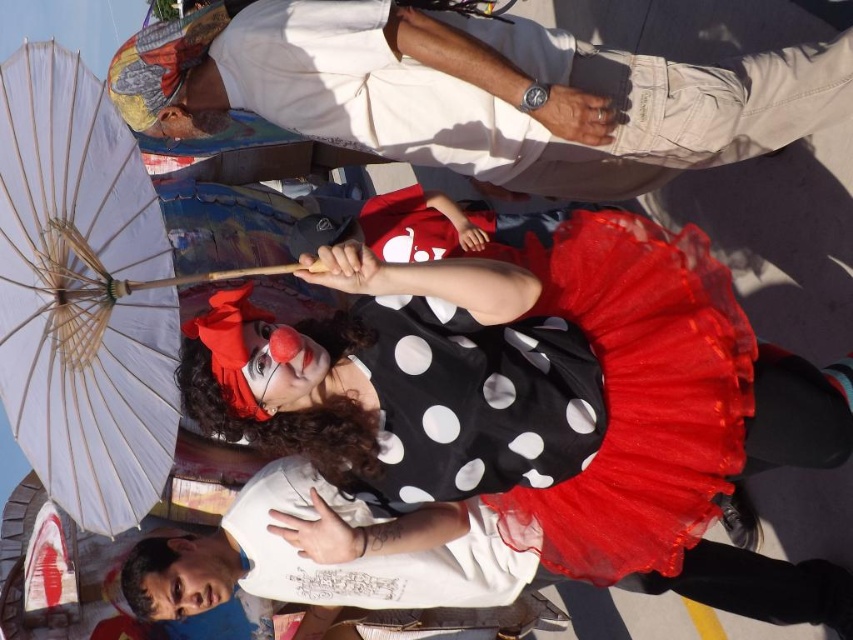
You are a photographer setting up for a group photo. You have a camera with a 30cm wide lens. You need to capture both the white cotton shirt at upper center and the black polka dot tulle dress at center in the same frame. Can the lens accommodate both objects if they are positioned side by side?

The white cotton shirt at upper center might be wider than the black polka dot tulle dress at center. Since the lens is 30cm wide, it depends on their combined width. If the total width of both objects together is less than or equal to 30cm, they can fit. However, if their combined width exceeds 30cm, they might not fit. The exact measurement isn

You are a photographer at the event and want to capture a clear photo of both the white cotton shirt at upper center and the white paper umbrella at left. Which object should you focus on first to ensure both are in focus?

You should focus on the white cotton shirt at upper center first because it is closer to you than the white paper umbrella at left. By focusing on the closer object, the umbrella will also be in focus due to the depth of field.

You are a photographer standing at the center of the scene. You want to take a photo that includes both the point at coordinates point (688, 99) and point (143, 240). Which point is closer to the camera?

Point (143, 240) is closer to the camera than point (688, 99).